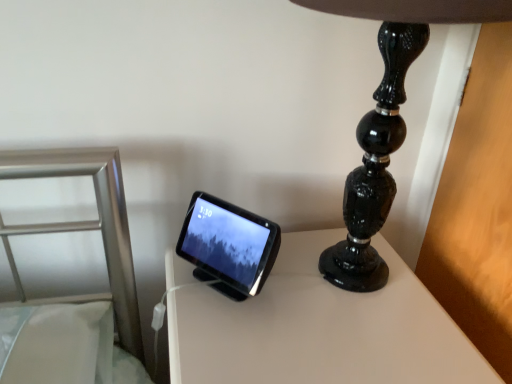
You are a GUI agent. You are given a task and a screenshot of the screen. Output one action in this format:
    pyautogui.click(x=<x>, y=<y>)
    Task: Click on the free point above white glossy table at center (from a real-world perspective)
    
    Given the screenshot: What is the action you would take?
    pyautogui.click(x=306, y=304)